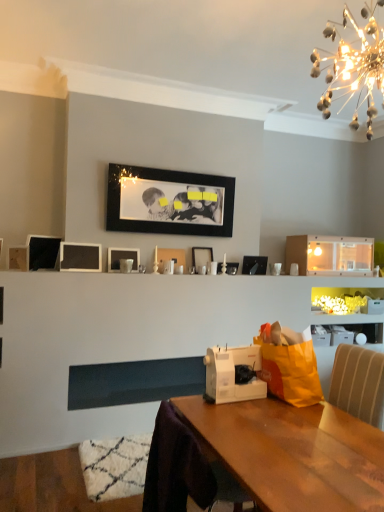
Question: Should I look upward or downward to see matte black picture frame at center, which ranks as the 3th picture frame in right-to-left order?

Choices:
 (A) up
 (B) down

Answer: (B)

Question: Can you confirm if illuminated glass chandelier at upper right is shorter than white plastic sewing machine at center?

Choices:
 (A) no
 (B) yes

Answer: (A)

Question: Is illuminated glass chandelier at upper right at the right side of white plastic sewing machine at center?

Choices:
 (A) no
 (B) yes

Answer: (B)

Question: Does illuminated glass chandelier at upper right lie behind white plastic sewing machine at center?

Choices:
 (A) yes
 (B) no

Answer: (B)

Question: Is illuminated glass chandelier at upper right to the left of white plastic sewing machine at center from the viewer's perspective?

Choices:
 (A) no
 (B) yes

Answer: (A)

Question: Can you confirm if illuminated glass chandelier at upper right is smaller than white plastic sewing machine at center?

Choices:
 (A) yes
 (B) no

Answer: (B)

Question: Considering the relative sizes of illuminated glass chandelier at upper right and white plastic sewing machine at center in the image provided, is illuminated glass chandelier at upper right thinner than white plastic sewing machine at center?

Choices:
 (A) yes
 (B) no

Answer: (B)

Question: Is white plastic sewing machine at center positioned behind matte black picture frame at center, which ranks as the 3th picture frame in right-to-left order?

Choices:
 (A) no
 (B) yes

Answer: (A)

Question: Is there a large distance between white plastic sewing machine at center and matte black picture frame at center, which ranks as the 3th picture frame in right-to-left order?

Choices:
 (A) no
 (B) yes

Answer: (B)

Question: Considering the relative sizes of white plastic sewing machine at center and matte black picture frame at center, which is counted as the sixth picture frame, starting from the left, in the image provided, is white plastic sewing machine at center shorter than matte black picture frame at center, which is counted as the sixth picture frame, starting from the left,?

Choices:
 (A) yes
 (B) no

Answer: (B)

Question: Could you tell me if white plastic sewing machine at center is turned towards matte black picture frame at center, which ranks as the 3th picture frame in right-to-left order?

Choices:
 (A) yes
 (B) no

Answer: (B)

Question: Is white plastic sewing machine at center located outside matte black picture frame at center, which is counted as the sixth picture frame, starting from the left?

Choices:
 (A) yes
 (B) no

Answer: (A)

Question: Is white plastic sewing machine at center taller than matte black picture frame at center, which is counted as the sixth picture frame, starting from the left?

Choices:
 (A) no
 (B) yes

Answer: (B)

Question: From the image's perspective, is matte black picture frame at center, which ranks as the 3th picture frame in right-to-left order, above white plastic sewing machine at center?

Choices:
 (A) yes
 (B) no

Answer: (A)